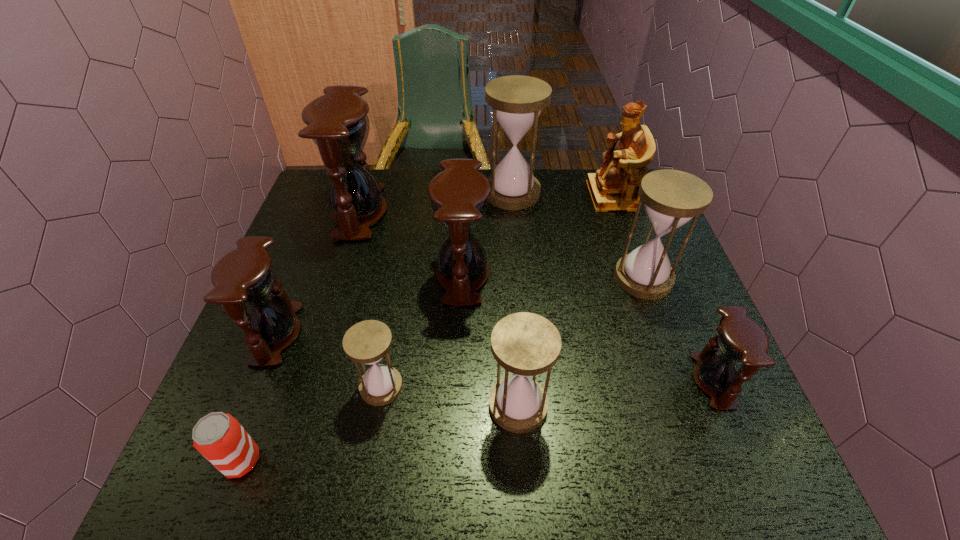
Locate an element on the screen. the third hourglass from left to right is located at coordinates (367, 342).

Find the location of `the nearest object`. the nearest object is located at coordinates pyautogui.click(x=220, y=438).

In order to click on orange beer can in this screenshot , I will do `click(220, 438)`.

In order to click on free spot located on the right of the farthest brown hourglass in this screenshot , I will do `click(520, 212)`.

Image resolution: width=960 pixels, height=540 pixels. I want to click on free spot located on the left of the farthest white hourglass, so click(x=420, y=193).

Find the location of a particular element. vacant area situated 0.150m on the front-facing side of the figurine is located at coordinates (540, 196).

You are a GUI agent. You are given a task and a screenshot of the screen. Output one action in this format:
    pyautogui.click(x=<x>, y=<y>)
    Task: Click on the vacant area situated 0.200m on the front-facing side of the figurine
    The height and width of the screenshot is (540, 960).
    Given the screenshot: What is the action you would take?
    pyautogui.click(x=524, y=196)

Identify the location of vacant area situated on the front-facing side of the figurine. The height and width of the screenshot is (540, 960). (517, 196).

Locate an element on the screen. vacant space located 0.360m on the left of the third smallest brown hourglass is located at coordinates (294, 274).

Identify the location of blank area located on the front of the second biggest white hourglass. (675, 368).